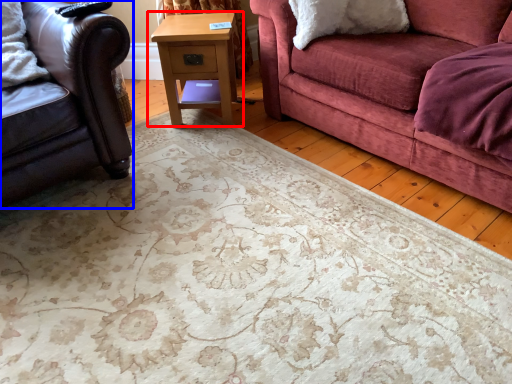
Question: Which of the following is the closest to the observer, table (highlighted by a red box) or studio couch (highlighted by a blue box)?

Choices:
 (A) table
 (B) studio couch

Answer: (B)